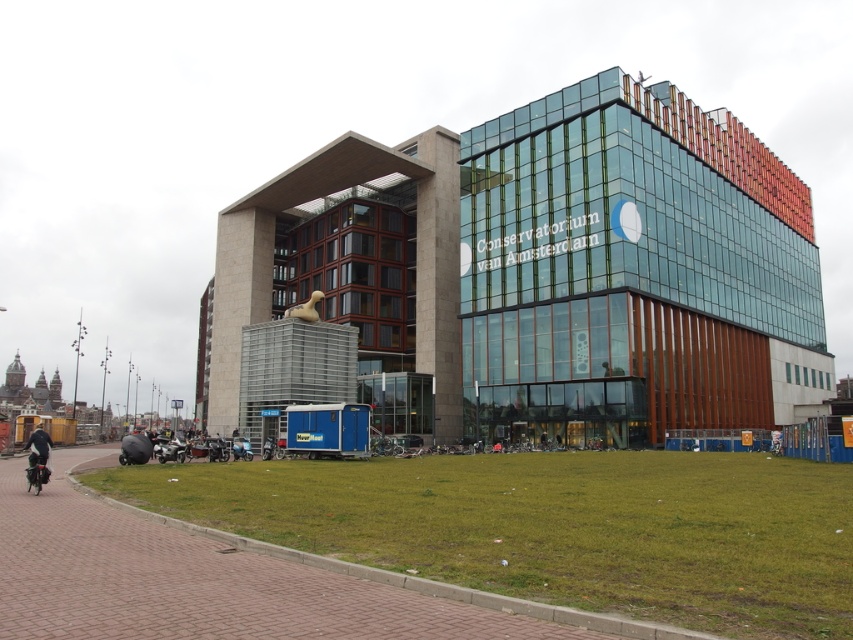
Question: Which object appears closest to the camera in this image?

Choices:
 (A) dark blue jacket at lower left
 (B) shiny blue motorcycle at center
 (C) metallic silver motorcycle at lower left
 (D) black matte motorcycle at lower left

Answer: (D)

Question: Which point appears closest to the camera in this image?

Choices:
 (A) [248, 618]
 (B) [218, 436]
 (C) [242, 444]

Answer: (A)

Question: Is brick pavement at lower left wider than black matte motorcycle at lower left?

Choices:
 (A) yes
 (B) no

Answer: (A)

Question: Does shiny chrome motorcycle at lower left appear over metallic silver motorcycle at lower left?

Choices:
 (A) no
 (B) yes

Answer: (B)

Question: Is brick pavement at lower left closer to camera compared to metallic silver motorcycle at lower left?

Choices:
 (A) no
 (B) yes

Answer: (B)

Question: Which of these objects is positioned closest to the metallic silver motorcycle at lower left?

Choices:
 (A) brick pavement at lower left
 (B) shiny chrome motorcycle at lower left
 (C) shiny blue motorcycle at center

Answer: (C)